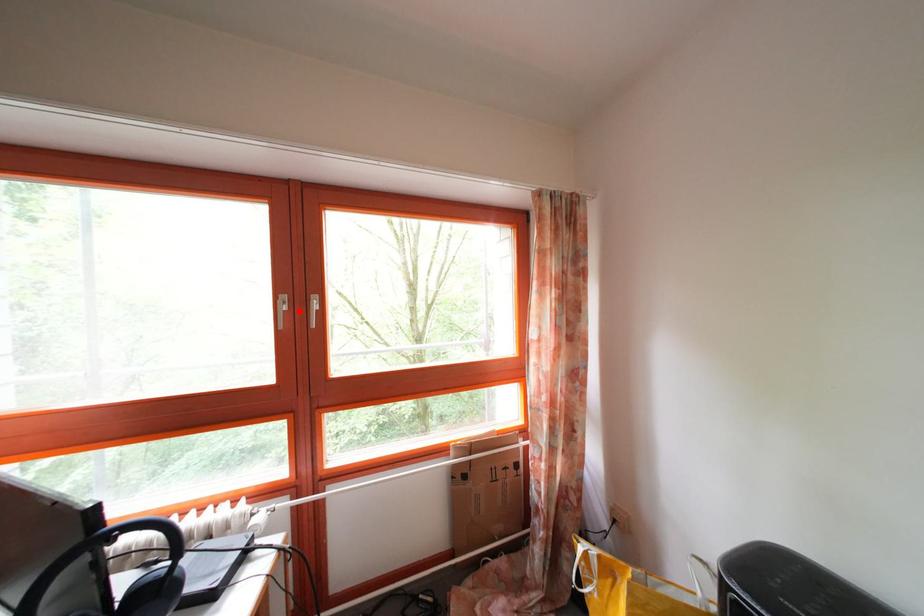
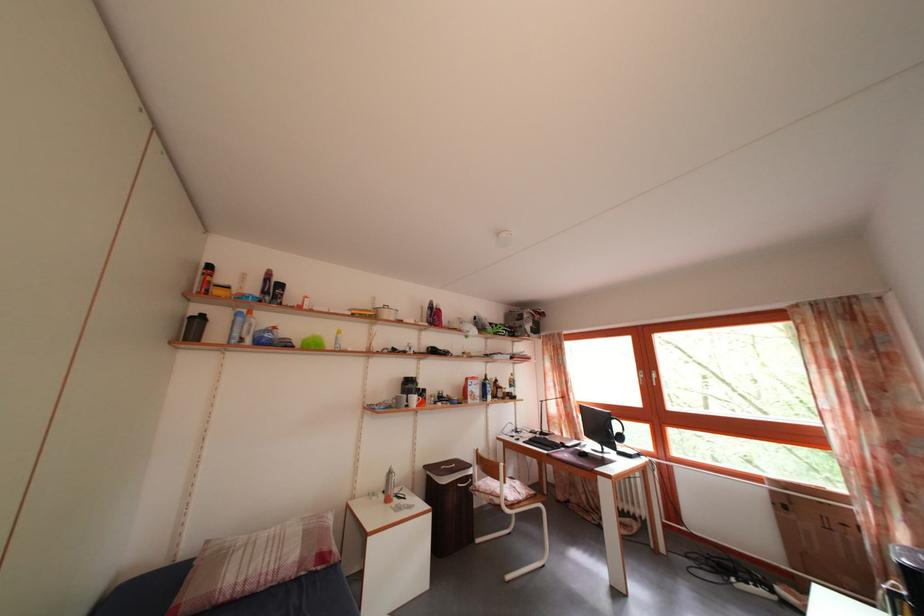
Locate, in the second image, the point that corresponds to the highlighted location in the first image.

(652, 382)